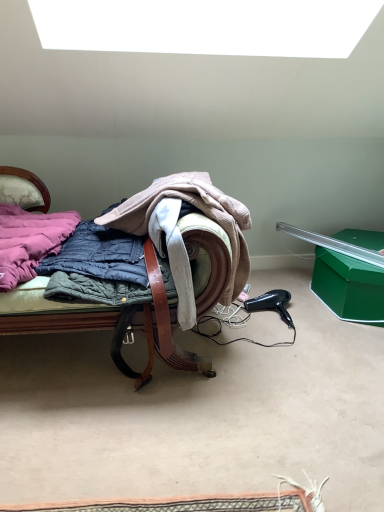
Question: Should I look upward or downward to see quilted fabric chair at center?

Choices:
 (A) up
 (B) down

Answer: (A)

Question: Is quilted fabric coat at center aimed at pink quilted jacket at left?

Choices:
 (A) yes
 (B) no

Answer: (B)

Question: Is quilted fabric coat at center behind pink quilted jacket at left?

Choices:
 (A) yes
 (B) no

Answer: (A)

Question: From the image's perspective, is quilted fabric coat at center below pink quilted jacket at left?

Choices:
 (A) no
 (B) yes

Answer: (B)

Question: Is quilted fabric coat at center next to pink quilted jacket at left?

Choices:
 (A) no
 (B) yes

Answer: (A)

Question: Is quilted fabric coat at center smaller than pink quilted jacket at left?

Choices:
 (A) no
 (B) yes

Answer: (A)

Question: Are quilted fabric coat at center and pink quilted jacket at left located far from each other?

Choices:
 (A) no
 (B) yes

Answer: (A)

Question: Can you confirm if quilted fabric chair at center is bigger than pink quilted jacket at left?

Choices:
 (A) yes
 (B) no

Answer: (A)

Question: Can you confirm if quilted fabric chair at center is taller than pink quilted jacket at left?

Choices:
 (A) no
 (B) yes

Answer: (B)

Question: From a real-world perspective, is quilted fabric chair at center located higher than pink quilted jacket at left?

Choices:
 (A) yes
 (B) no

Answer: (B)

Question: Is quilted fabric chair at center wider than pink quilted jacket at left?

Choices:
 (A) no
 (B) yes

Answer: (B)

Question: Does quilted fabric chair at center appear on the left side of pink quilted jacket at left?

Choices:
 (A) no
 (B) yes

Answer: (A)

Question: Is quilted fabric chair at center far from pink quilted jacket at left?

Choices:
 (A) yes
 (B) no

Answer: (B)

Question: Considering the relative sizes of quilted fabric chair at center and quilted fabric coat at center in the image provided, is quilted fabric chair at center thinner than quilted fabric coat at center?

Choices:
 (A) yes
 (B) no

Answer: (B)